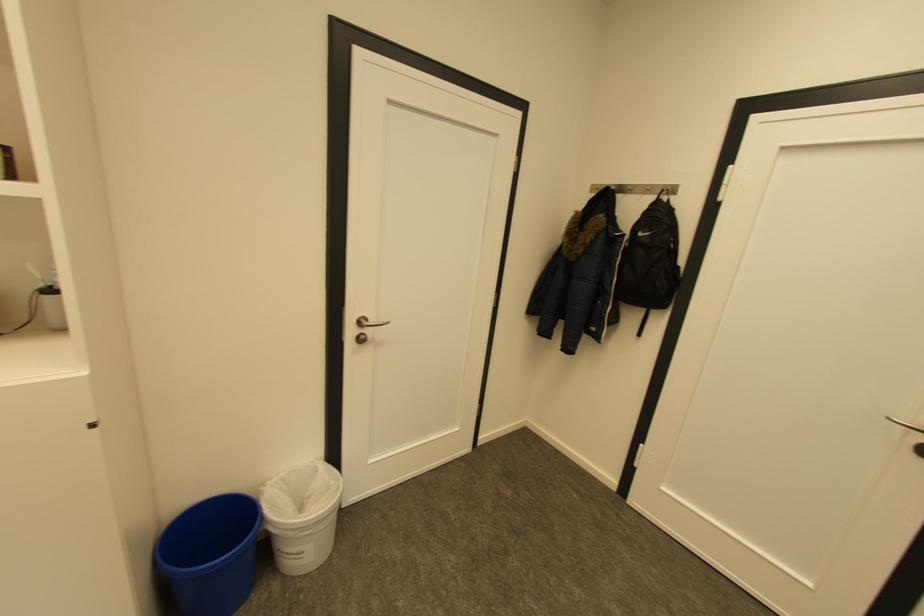
Describe the element at coordinates (210, 554) in the screenshot. Image resolution: width=924 pixels, height=616 pixels. I see `the blue trash can` at that location.